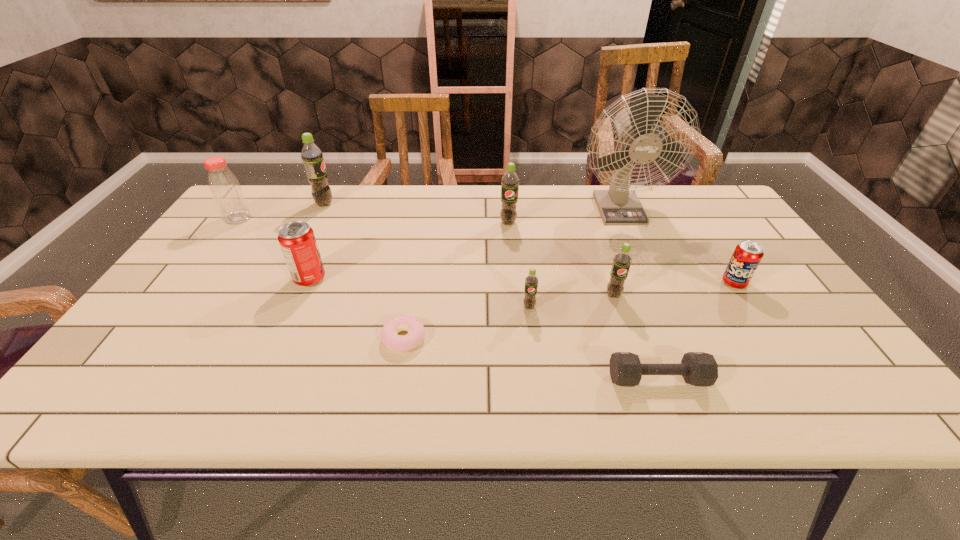
The height and width of the screenshot is (540, 960). I want to click on bottle at the far edge, so click(226, 191).

Locate an element on the screen. The height and width of the screenshot is (540, 960). object that is at the near edge is located at coordinates (697, 368).

You are a GUI agent. You are given a task and a screenshot of the screen. Output one action in this format:
    pyautogui.click(x=<x>, y=<y>)
    Task: Click on the object that is positioned at the left edge
    
    Given the screenshot: What is the action you would take?
    pyautogui.click(x=226, y=191)

Where is `object that is at the right edge`? object that is at the right edge is located at coordinates (747, 255).

Find the location of a particular element. object that is at the far left corner is located at coordinates (226, 191).

Locate an element on the screen. The width and height of the screenshot is (960, 540). free region at the far edge of the desktop is located at coordinates (444, 194).

The height and width of the screenshot is (540, 960). In order to click on free space at the near edge of the desktop in this screenshot , I will do `click(468, 387)`.

Locate an element on the screen. The image size is (960, 540). vacant space at the left edge is located at coordinates (197, 271).

The image size is (960, 540). I want to click on free space at the right edge, so click(761, 340).

In the image, there is a desktop. Where is `free space at the far left corner`? The width and height of the screenshot is (960, 540). free space at the far left corner is located at coordinates (249, 194).